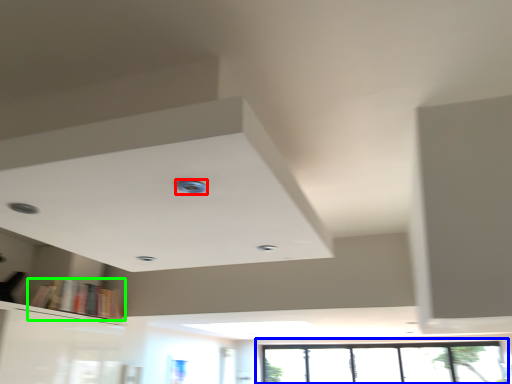
Question: Which object is the closest to the hole (highlighted by a red box)? Choose among these: window (highlighted by a blue box) or book (highlighted by a green box).

Choices:
 (A) window
 (B) book

Answer: (B)